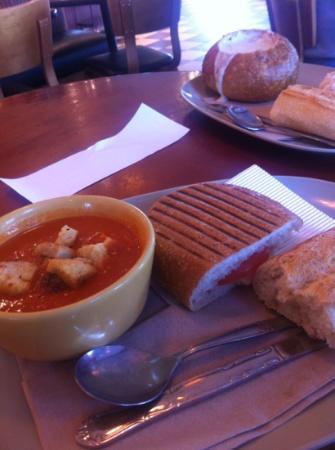
Identify the location of chairs backgroound. This screenshot has width=335, height=450. (50, 64), (131, 55), (310, 33).